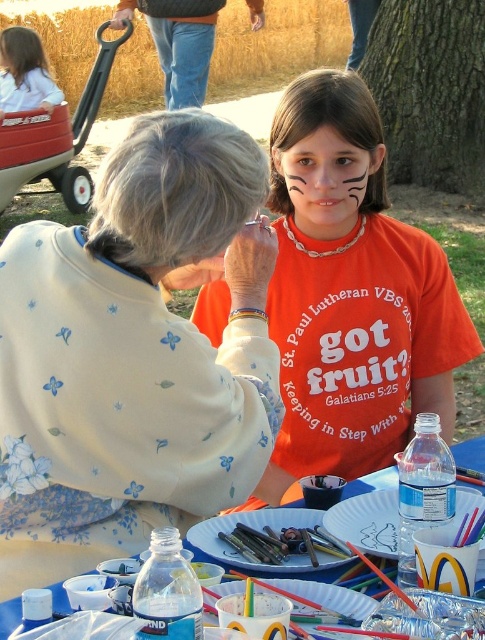
Question: Considering the relative positions of white paper plate at lower center and white paper plate at center in the image provided, where is white paper plate at lower center located with respect to white paper plate at center?

Choices:
 (A) below
 (B) above

Answer: (B)

Question: Considering the real-world distances, which object is closest to the black matte tiger stripes at center?

Choices:
 (A) orange matte shirt at center
 (B) white paper plate at center

Answer: (A)

Question: Does orange matte shirt at center appear over white paper plate at center?

Choices:
 (A) yes
 (B) no

Answer: (A)

Question: Which object appears farthest from the camera in this image?

Choices:
 (A) floral-patterned fabric at upper left
 (B) blue paper plate at lower center
 (C) translucent plastic bottle at lower center

Answer: (C)

Question: Among these objects, which one is nearest to the camera?

Choices:
 (A) smooth white shirt at upper left
 (B) white paper plate at center

Answer: (B)

Question: Is orange matte shirt at center to the left of white paper plate at lower center from the viewer's perspective?

Choices:
 (A) no
 (B) yes

Answer: (B)